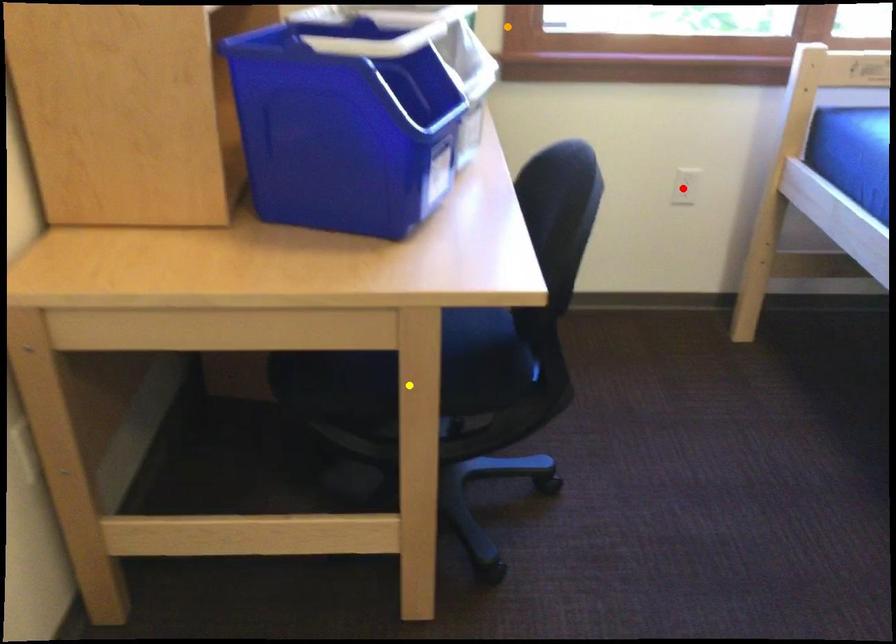
Order these from nearest to farthest:
red point, yellow point, orange point

red point
orange point
yellow point